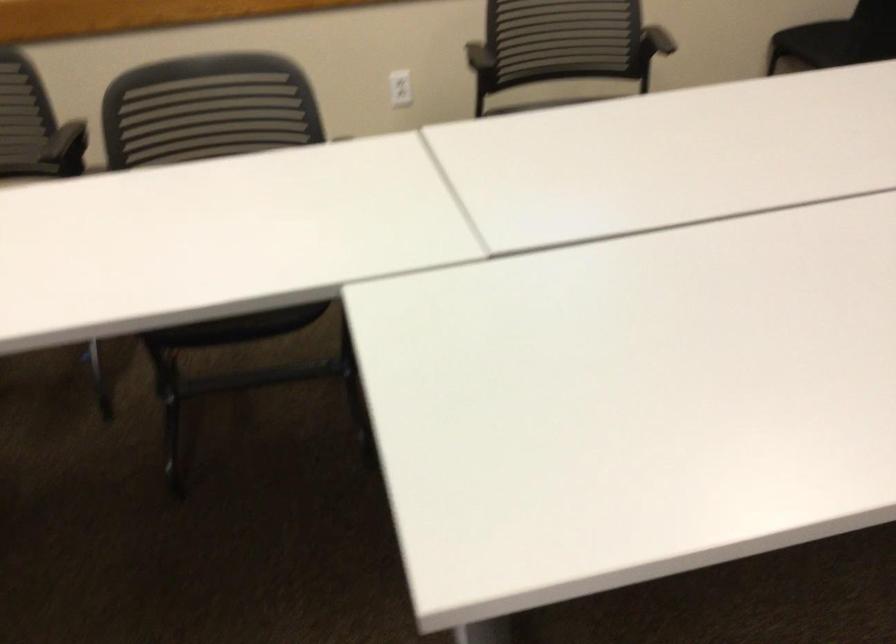
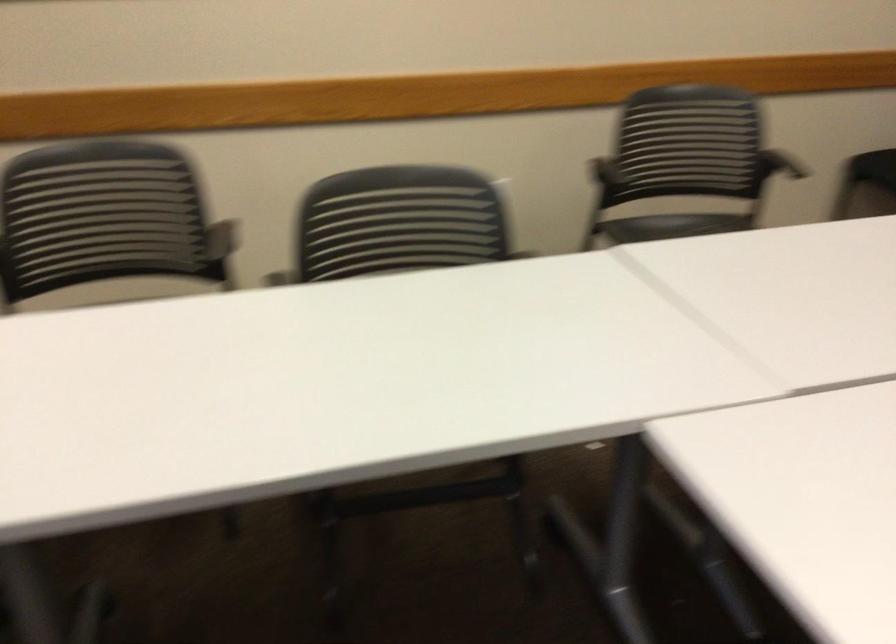
Question: I am providing you with two images of the same scene from different viewpoints. After the viewpoint changes to image2, which objects are now occluded?

Choices:
 (A) black chair sitting surface
 (B) black chair armrest
 (C) small golden box
 (D) chair sitting surface

Answer: (D)